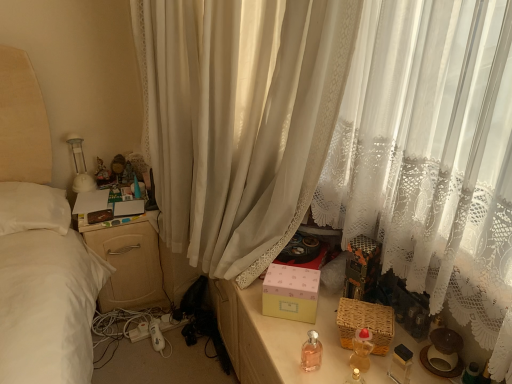
Question: Is pink matte box at center to the left or to the right of white sheer curtain at center in the image?

Choices:
 (A) right
 (B) left

Answer: (A)

Question: Is pink matte box at center wider or thinner than white sheer curtain at center?

Choices:
 (A) wide
 (B) thin

Answer: (B)

Question: Which is farther from the beige wood nightstand at left?

Choices:
 (A) white sheer curtain at center
 (B) translucent plastic baby bottle at lower right, the second baby bottle positioned from the left
 (C) pink matte box at center
 (D) pink glass bottle at center, the first baby bottle positioned from the left
 (E) matte plastic figurine at upper left

Answer: (B)

Question: Which object is positioned closest to the translucent plastic baby bottle at lower right, placed as the first baby bottle when sorted from right to left?

Choices:
 (A) pink matte box at center
 (B) beige wood nightstand at left
 (C) white sheer curtain at center
 (D) pink glass bottle at center, which is counted as the 2th baby bottle, starting from the right
 (E) matte plastic figurine at upper left

Answer: (D)